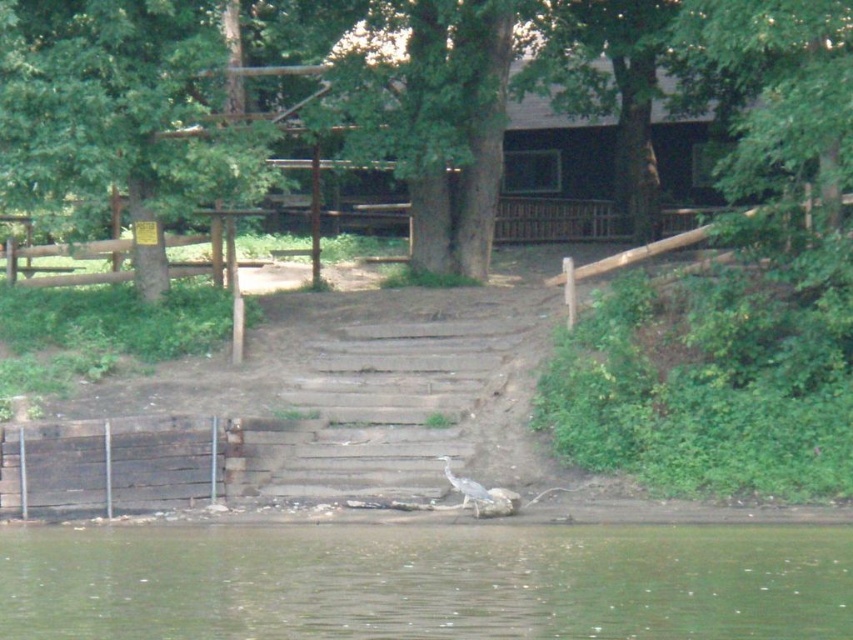
Based on the photo, you are a photographer standing at the riverside. You want to capture a photo where the green liquid water at lower center and the green leafy tree at upper left are both visible. Based on their positions, which object is closer to the camera?

The green liquid water at lower center is closer to the camera because it is positioned below the green leafy tree at upper left, indicating it is in the foreground.

You are standing at the riverbank and want to take a photo of the two points marked in the image. Which point, point (306, 584) or point (0, 136), will appear larger in your camera view?

Point (306, 584) will appear larger in the camera view because it is closer to the viewer than point (0, 136).

You are a photographer trying to capture the gray matte bird at lower center in your shot. You notice the green liquid water at lower center might be obstructing the view. Is the water level higher or lower than the bird?

The green liquid water at lower center is shorter than the gray matte bird at lower center, meaning the water level is lower than the bird, so it won